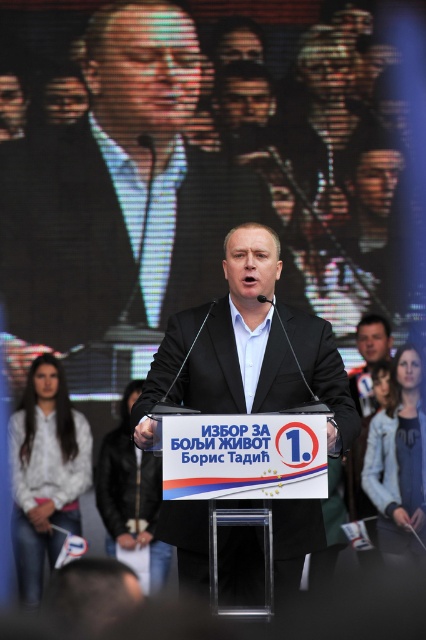
Is black matte suit at center positioned in front of matte black suit at center?

That is False.

Is point (66, 186) in front of point (229, 339)?

No, it is not.

Is point (250, 196) less distant than point (273, 524)?

No, (250, 196) is behind (273, 524).

Find the location of a particular element. The height and width of the screenshot is (640, 426). black matte suit at center is located at coordinates (118, 188).